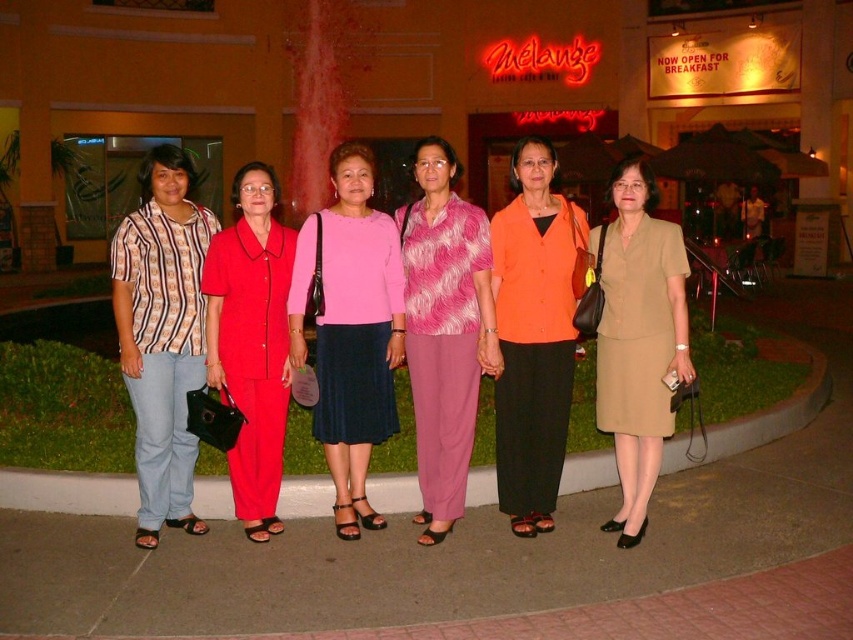
Question: Which object is the closest to the matte red suit at center?

Choices:
 (A) pink fabric skirt at center
 (B) pink fuzzy sweater at center

Answer: (A)

Question: Does pink fuzzy sweater at center appear under matte red suit at center?

Choices:
 (A) yes
 (B) no

Answer: (B)

Question: Is pink fuzzy sweater at center smaller than beige fabric dress at center?

Choices:
 (A) yes
 (B) no

Answer: (A)

Question: Which object appears farthest from the camera in this image?

Choices:
 (A) beige fabric dress at center
 (B) matte red suit at center
 (C) orange matte shirt at center

Answer: (C)

Question: Is pink fuzzy sweater at center bigger than beige fabric dress at center?

Choices:
 (A) yes
 (B) no

Answer: (B)

Question: Which of these objects is positioned closest to the pink fabric skirt at center?

Choices:
 (A) matte red suit at center
 (B) beige fabric dress at center

Answer: (A)